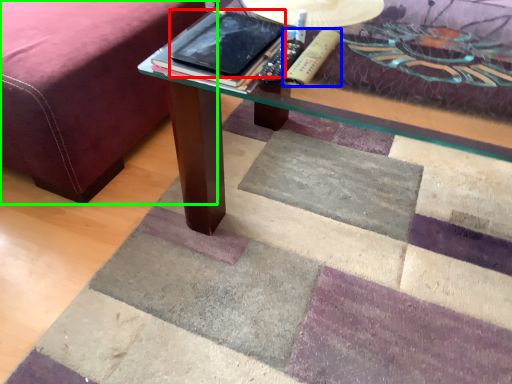
Question: Which object is the farthest from tablet computer (highlighted by a red box)? Choose among these: remote (highlighted by a blue box) or bed frame (highlighted by a green box).

Choices:
 (A) remote
 (B) bed frame

Answer: (B)